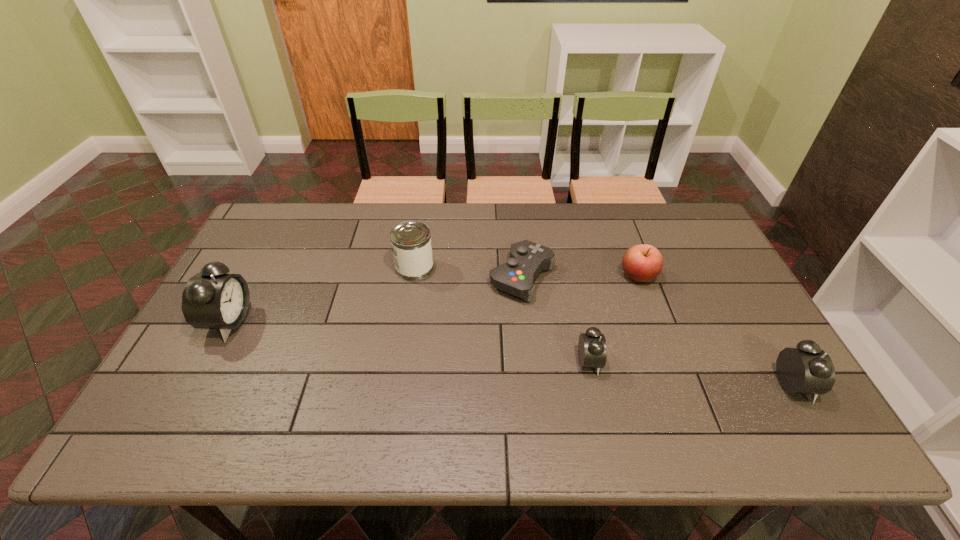
In order to click on the farthest alarm clock in this screenshot , I will do `click(212, 299)`.

This screenshot has height=540, width=960. I want to click on the tallest alarm clock, so click(212, 299).

The width and height of the screenshot is (960, 540). In order to click on the second alarm clock from right to left in this screenshot , I will do `click(592, 351)`.

Identify the location of the fourth object from left to right. This screenshot has width=960, height=540. (592, 351).

At what (x,y) coordinates should I click in order to perform the action: click on the rightmost object. Please return your answer as a coordinate pair (x, y). This screenshot has width=960, height=540. Looking at the image, I should click on (807, 369).

Where is `the rightmost alarm clock`? The height and width of the screenshot is (540, 960). the rightmost alarm clock is located at coordinates (807, 369).

Find the location of a particular element. The height and width of the screenshot is (540, 960). the shortest object is located at coordinates (527, 259).

Identify the location of the third object from left to right. This screenshot has width=960, height=540. (527, 259).

At what (x,y) coordinates should I click in order to perform the action: click on the fifth object from right to left. Please return your answer as a coordinate pair (x, y). The width and height of the screenshot is (960, 540). Looking at the image, I should click on (411, 244).

This screenshot has height=540, width=960. Find the location of `the fifth object from left to right`. the fifth object from left to right is located at coordinates (643, 262).